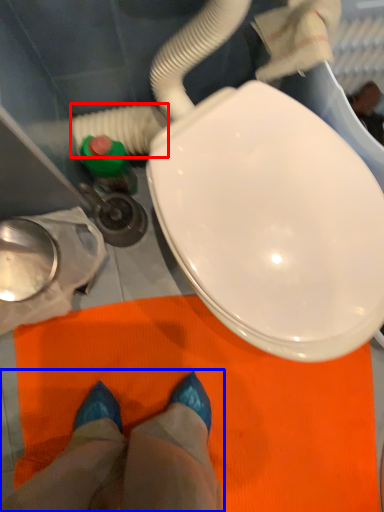
Question: Among these objects, which one is nearest to the camera, water pipe (highlighted by a red box) or person (highlighted by a blue box)?

Choices:
 (A) water pipe
 (B) person

Answer: (A)